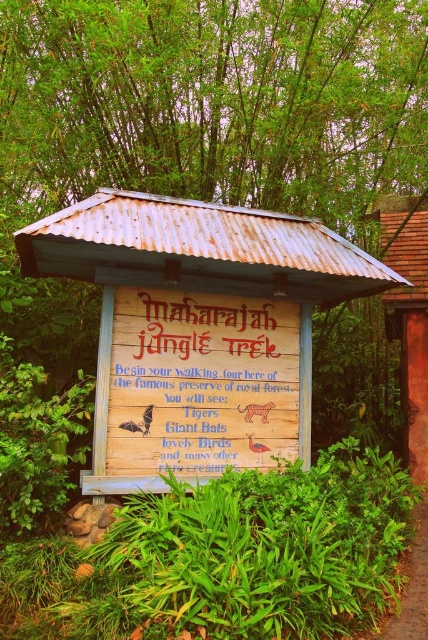
You are standing at the entrance of the Maharajah Jungle Trek and want to find the path to start your tour. Which object is closer to you between the wooden sign at center and the brown dirt path at lower right?

The wooden sign at center is closer to you than the brown dirt path at lower right.

You are standing 5 meters away from a rusty corrugated metal hut at center. Can you step forward to touch it without moving more than 0.3 meters?

The distance of rusty corrugated metal hut at center from viewer is 4.71 meters. Since you are currently 5 meters away, stepping forward 0.3 meters would bring you to 4.7 meters, which is still 0.01 meters away from the hut. Therefore, you cannot touch it without moving more than 0.3 meters.

You are a tour guide leading a group to the dirt path. You want to ensure that your group can walk through the brown dirt path at lower right comfortably. Given that the path is narrower than the wooden sign at center, what should you advise your group about the path?

The brown dirt path at lower right is narrower than the wooden sign at center, so you should advise the group to walk single file to ensure everyone can pass through comfortably.